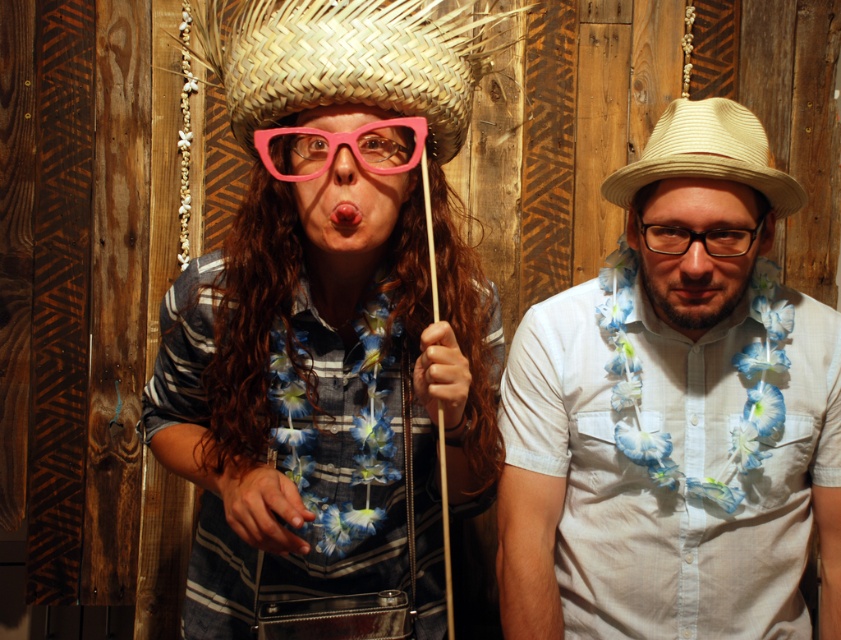
Can you confirm if woven straw cowboy hat at right is positioned below pink plastic glasses at center?

Incorrect, woven straw cowboy hat at right is not positioned below pink plastic glasses at center.

Locate an element on the screen. Image resolution: width=841 pixels, height=640 pixels. woven straw cowboy hat at right is located at coordinates point(706,154).

I want to click on matte straw hat at center, so click(329, 324).

Is matte straw hat at center shorter than pink matte plastic nose at center?

No, matte straw hat at center is not shorter than pink matte plastic nose at center.

You are a GUI agent. You are given a task and a screenshot of the screen. Output one action in this format:
    pyautogui.click(x=<x>, y=<y>)
    Task: Click on the matte straw hat at center
    
    Given the screenshot: What is the action you would take?
    pyautogui.click(x=329, y=324)

Where is `matte straw hat at center`? matte straw hat at center is located at coordinates tap(329, 324).

Between point (326, 33) and point (348, 224), which one is positioned behind?

Positioned behind is point (348, 224).

Does braided straw cowboy hat at center appear over pink matte lips at center?

Indeed, braided straw cowboy hat at center is positioned over pink matte lips at center.

I want to click on braided straw cowboy hat at center, so click(x=347, y=60).